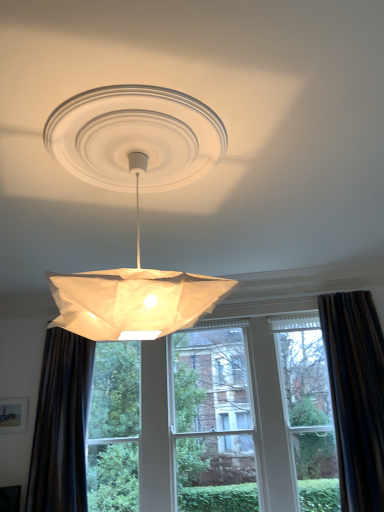
Question: Is dark brown textured curtain at left, the second curtain from the right, oriented towards dark fabric curtain at right, which appears as the second curtain when viewed from the left?

Choices:
 (A) no
 (B) yes

Answer: (A)

Question: From the image's perspective, is dark brown textured curtain at left, the second curtain from the right, on dark fabric curtain at right, which appears as the second curtain when viewed from the left?

Choices:
 (A) no
 (B) yes

Answer: (A)

Question: Considering the relative positions of dark brown textured curtain at left, the second curtain from the right, and dark fabric curtain at right, which appears as the second curtain when viewed from the left, in the image provided, is dark brown textured curtain at left, the second curtain from the right, to the right of dark fabric curtain at right, which appears as the second curtain when viewed from the left, from the viewer's perspective?

Choices:
 (A) no
 (B) yes

Answer: (A)

Question: Considering the relative sizes of dark brown textured curtain at left, the second curtain from the right, and dark fabric curtain at right, which appears as the second curtain when viewed from the left, in the image provided, is dark brown textured curtain at left, the second curtain from the right, smaller than dark fabric curtain at right, which appears as the second curtain when viewed from the left,?

Choices:
 (A) no
 (B) yes

Answer: (B)

Question: Is the surface of dark brown textured curtain at left, the 1th curtain positioned from the left, in direct contact with dark fabric curtain at right, which appears as the second curtain when viewed from the left?

Choices:
 (A) yes
 (B) no

Answer: (B)

Question: Is point (61, 338) closer or farther from the camera than point (355, 476)?

Choices:
 (A) farther
 (B) closer

Answer: (A)

Question: Looking at their shapes, would you say dark brown textured curtain at left, the second curtain from the right, is wider or thinner than dark fabric curtain at right, which appears as the second curtain when viewed from the left?

Choices:
 (A) thin
 (B) wide

Answer: (B)

Question: Which is correct: dark brown textured curtain at left, the second curtain from the right, is inside dark fabric curtain at right, which appears as the second curtain when viewed from the left, or outside of it?

Choices:
 (A) outside
 (B) inside

Answer: (A)

Question: From the image's perspective, is dark brown textured curtain at left, the second curtain from the right, positioned above or below dark fabric curtain at right, which appears as the second curtain when viewed from the left?

Choices:
 (A) below
 (B) above

Answer: (A)

Question: From their relative heights in the image, would you say dark fabric curtain at right, marked as the 1th curtain in a right-to-left arrangement, is taller or shorter than dark brown textured curtain at left, the 1th curtain positioned from the left?

Choices:
 (A) short
 (B) tall

Answer: (B)

Question: From a real-world perspective, relative to dark brown textured curtain at left, the second curtain from the right, is dark fabric curtain at right, marked as the 1th curtain in a right-to-left arrangement, vertically above or below?

Choices:
 (A) below
 (B) above

Answer: (A)

Question: Considering the positions of point (349, 440) and point (64, 440), is point (349, 440) closer or farther from the camera than point (64, 440)?

Choices:
 (A) closer
 (B) farther

Answer: (A)

Question: Relative to dark brown textured curtain at left, the second curtain from the right, is dark fabric curtain at right, marked as the 1th curtain in a right-to-left arrangement, in front or behind?

Choices:
 (A) front
 (B) behind

Answer: (A)

Question: Is dark brown textured curtain at left, the 1th curtain positioned from the left, bigger or smaller than white paper lampshade at center?

Choices:
 (A) big
 (B) small

Answer: (B)

Question: Is point (41, 439) closer or farther from the camera than point (77, 98)?

Choices:
 (A) closer
 (B) farther

Answer: (B)